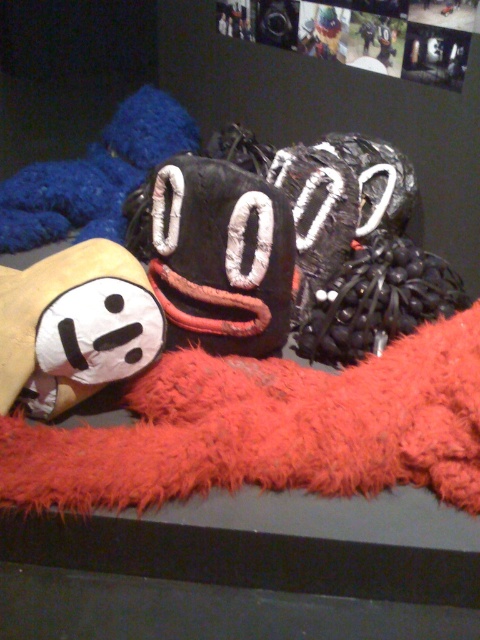
You are holding a camera and want to take a photo of the white plush toy at center. If you are standing 1.54 meters away from it, is this a suitable distance for a closeup shot?

The white plush toy at center and camera are 1.54 meters apart from each other. This distance may be too far for a closeup shot, as closeups typically require being much closer to the subject to capture fine details.

You are an artist examining the arrangement of the white plush toy at center and the fuzzy blue plush at upper left. Which of these two plush toys is shorter?

The white plush toy at center is not as tall as the fuzzy blue plush at upper left, so it is shorter.

You are an artist planning to place a new sculpture that is 20 cm wide in this display. The white plush toy at center and the fuzzy blue plush at upper left are already present. Which of these two existing plush toys has enough space next to it to accommodate the new sculpture without overlapping?

The fuzzy blue plush at upper left has a greater width than the white plush toy at center, so placing the new 20 cm wide sculpture next to the fuzzy blue plush at upper left would have more space available compared to the white plush toy at center.